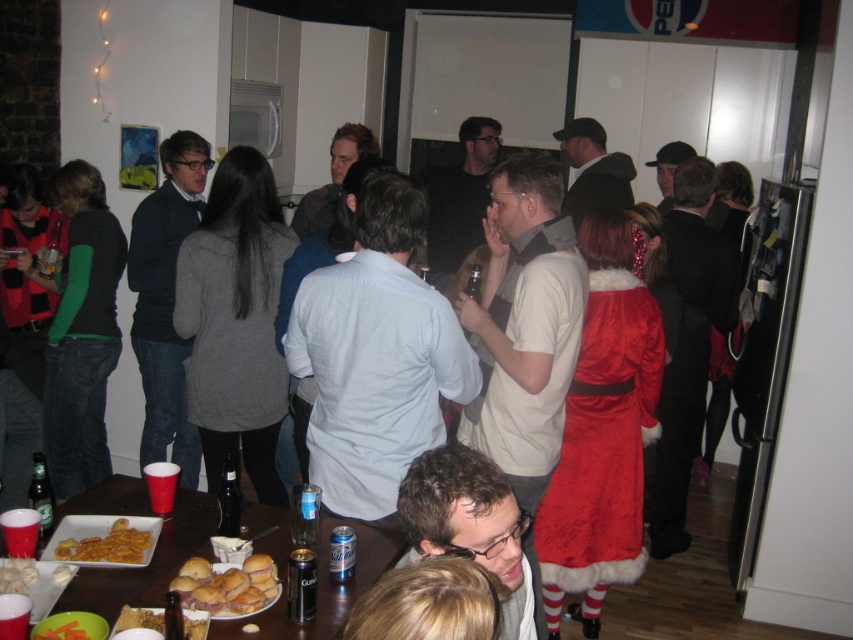
Is golden brown bread rolls at lower center taller than orange carrot at lower left?

Yes.

Between golden brown bread rolls at lower center and orange carrot at lower left, which one is positioned lower?

Positioned lower is orange carrot at lower left.

Identify the location of golden brown bread rolls at lower center. The image size is (853, 640). (227, 586).

In order to click on golden brown bread rolls at lower center in this screenshot , I will do `click(227, 586)`.

Is blue glass can at center taller than metallic silver can at lower center?

Yes, blue glass can at center is taller than metallic silver can at lower center.

Find the location of a particular element. Image resolution: width=853 pixels, height=640 pixels. blue glass can at center is located at coordinates (305, 513).

Find the location of a particular element. The image size is (853, 640). blue glass can at center is located at coordinates (305, 513).

Find the location of a particular element. The height and width of the screenshot is (640, 853). blue glass can at center is located at coordinates (305, 513).

Can you confirm if blue glass can at center is bigger than green matte beer bottle at lower left?

No, blue glass can at center is not bigger than green matte beer bottle at lower left.

Locate an element on the screen. The image size is (853, 640). blue glass can at center is located at coordinates (305, 513).